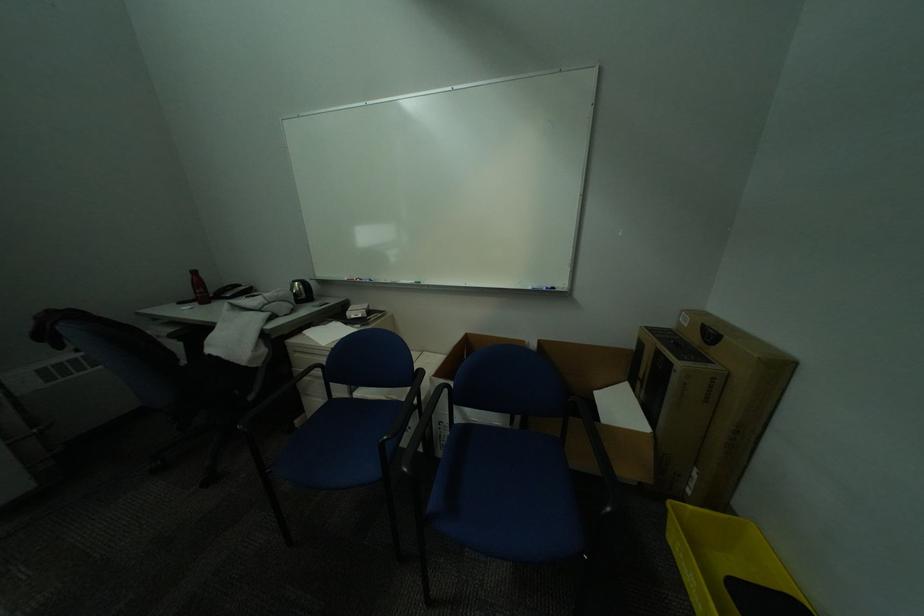
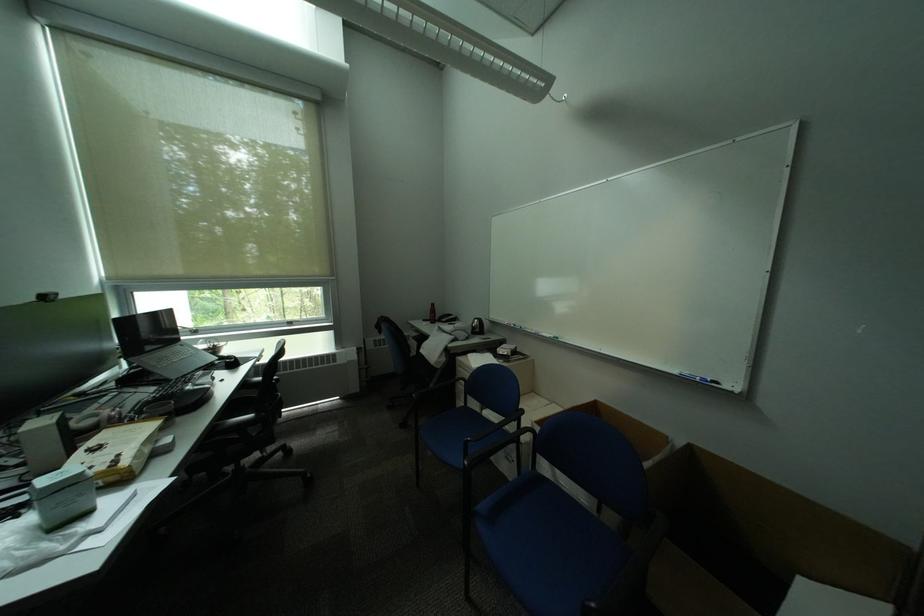
Question: The camera is either moving clockwise (left) or counter-clockwise (right) around the object. The first image is from the beginning of the video and the second image is from the end. Is the camera moving left or right when shooting the video?

Choices:
 (A) Left
 (B) Right

Answer: (B)